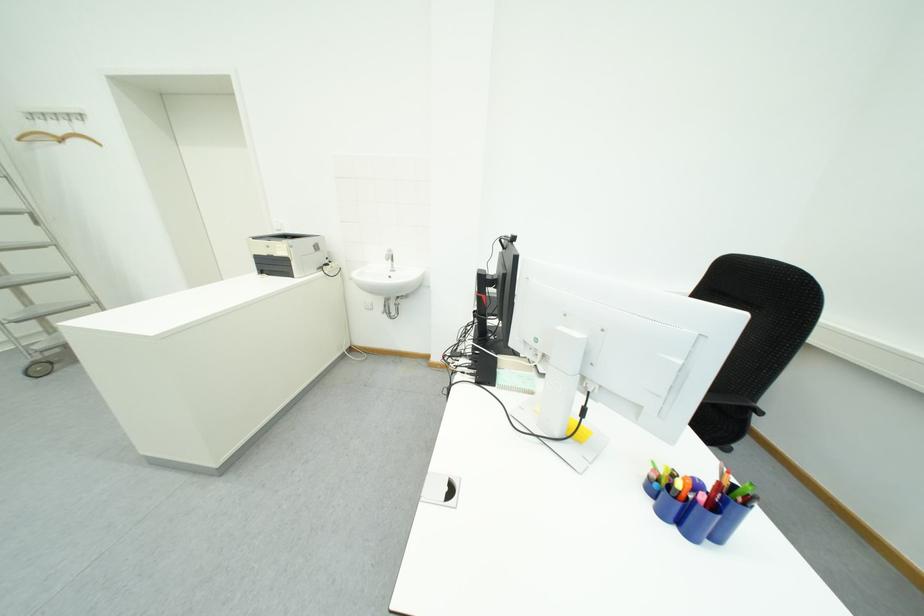
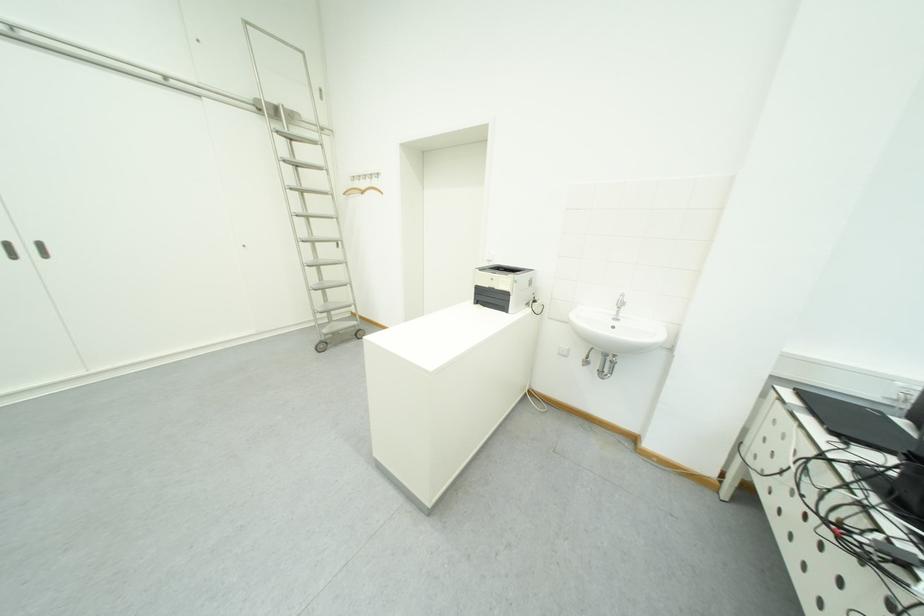
The point at [66,130] is marked in the first image. Where is the corresponding point in the second image?

(372, 185)